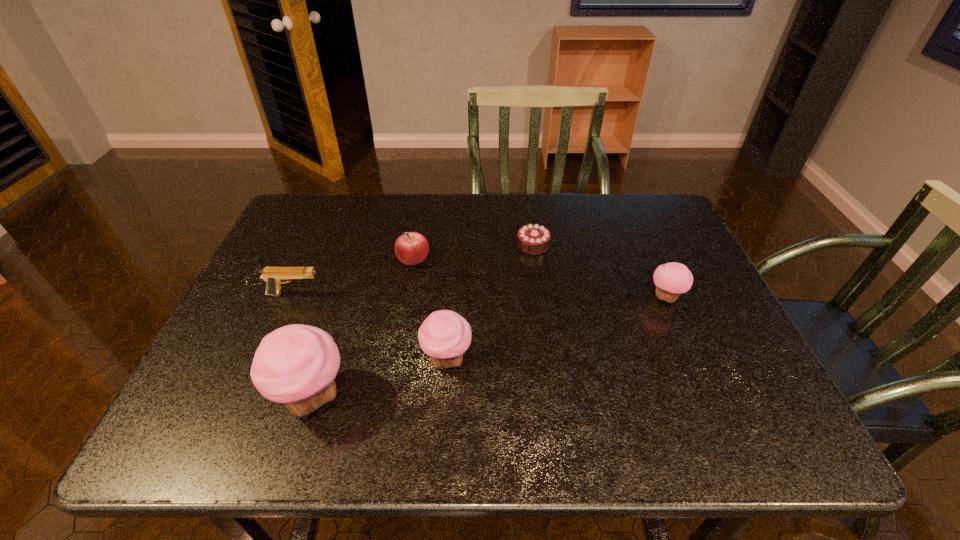
Point out which cupcake is positioned as the nearest to the fifth shortest object. Please provide its 2D coordinates. Your answer should be formatted as a tuple, i.e. [(x, y)], where the tuple contains the x and y coordinates of a point satisfying the conditions above.

[(296, 364)]

In order to click on free space that satisfies the following two spatial constraints: 1. on the back side of the rightmost object; 2. on the left side of the tallest cupcake in this screenshot , I will do click(x=344, y=297).

You are a GUI agent. You are given a task and a screenshot of the screen. Output one action in this format:
    pyautogui.click(x=<x>, y=<y>)
    Task: Click on the vacant space that satisfies the following two spatial constraints: 1. on the front side of the chocolate cake; 2. at the barrel of the pistol
    Image resolution: width=960 pixels, height=540 pixels.
    Given the screenshot: What is the action you would take?
    pyautogui.click(x=540, y=294)

Where is `free location that satisfies the following two spatial constraints: 1. on the front side of the apple; 2. at the barrel of the pistol`? free location that satisfies the following two spatial constraints: 1. on the front side of the apple; 2. at the barrel of the pistol is located at coordinates (407, 294).

Locate an element on the screen. The height and width of the screenshot is (540, 960). free spot that satisfies the following two spatial constraints: 1. on the back side of the leftmost cupcake; 2. on the right side of the second object from right to left is located at coordinates (360, 245).

Locate an element on the screen. free point that satisfies the following two spatial constraints: 1. on the front side of the chocolate cake; 2. on the left side of the shortest cupcake is located at coordinates (540, 297).